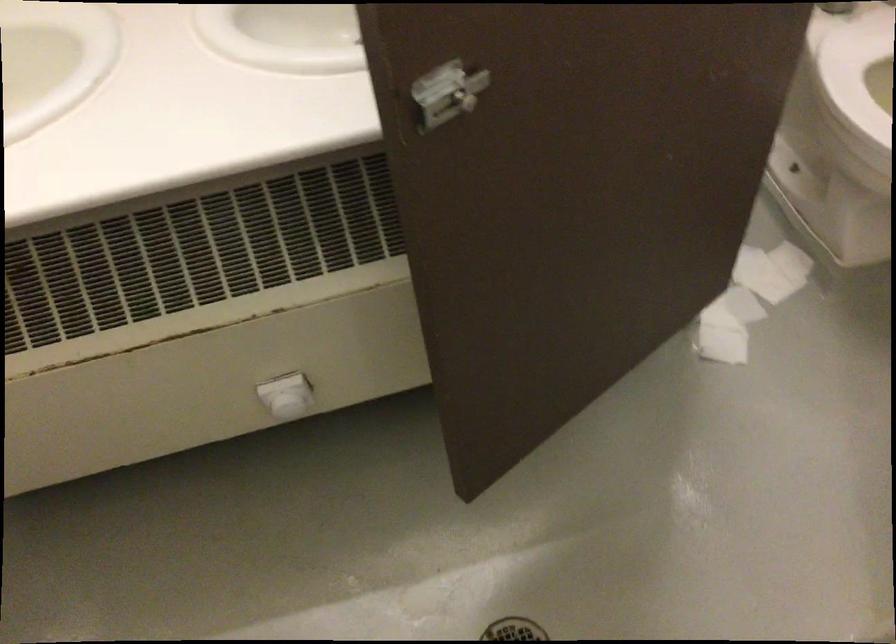
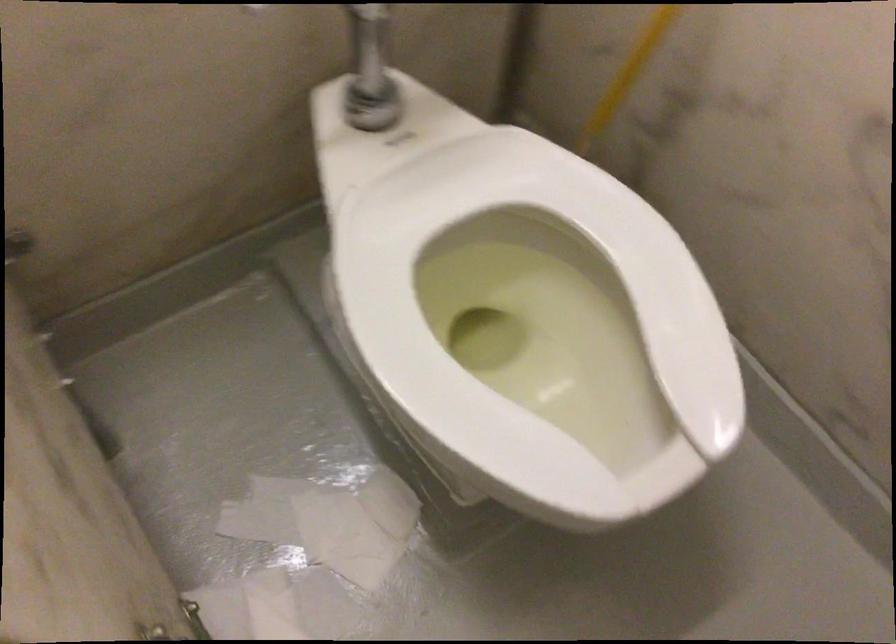
Consider the image. Which direction would the cameraman need to move to produce the second image?

The cameraman moved toward right, forward.